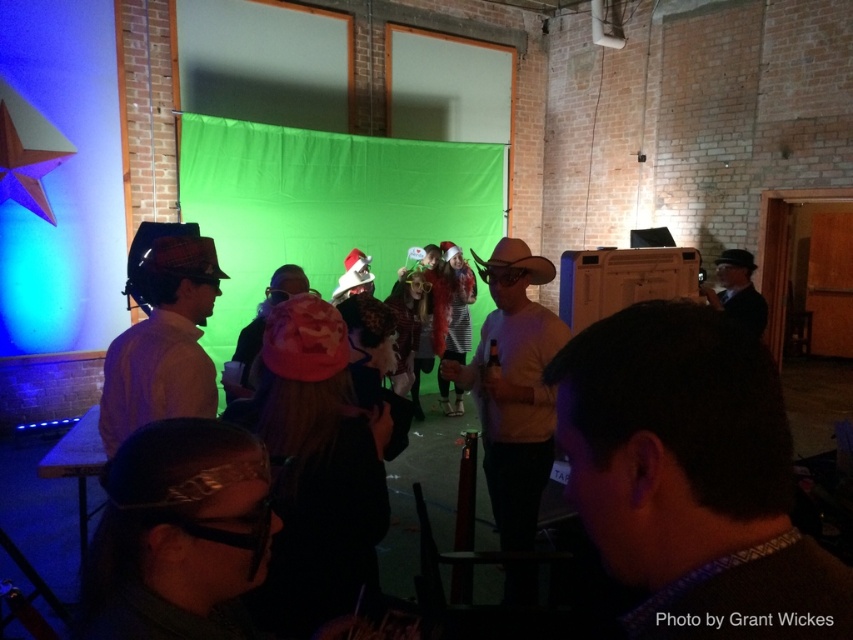
Is matte brown hat at left positioned in front of matte black suit at right?

Yes, matte brown hat at left is in front of matte black suit at right.

Between point (106, 380) and point (758, 292), which one is positioned behind?

The point (758, 292) is more distant.

Identify the location of matte brown hat at left. (161, 340).

Is point (737, 524) in front of point (86, 83)?

Yes, point (737, 524) is in front of point (86, 83).

Is the position of brown fuzzy sweater at center more distant than that of blue matte star at left?

No, brown fuzzy sweater at center is closer to the viewer.

Does point (775, 572) come farther from viewer compared to point (79, 118)?

No, it is not.

You are a GUI agent. You are given a task and a screenshot of the screen. Output one action in this format:
    pyautogui.click(x=<x>, y=<y>)
    Task: Click on the brown fuzzy sweater at center
    The height and width of the screenshot is (640, 853).
    Given the screenshot: What is the action you would take?
    pyautogui.click(x=691, y=477)

Locate an element on the screen. brown fuzzy sweater at center is located at coordinates click(691, 477).

Between brown fuzzy sweater at center and matte brown hat at left, which one is positioned higher?

brown fuzzy sweater at center is above.

Who is more distant from viewer, (846,568) or (161,243)?

The point (161,243) is behind.

This screenshot has height=640, width=853. In order to click on brown fuzzy sweater at center in this screenshot , I will do click(x=691, y=477).